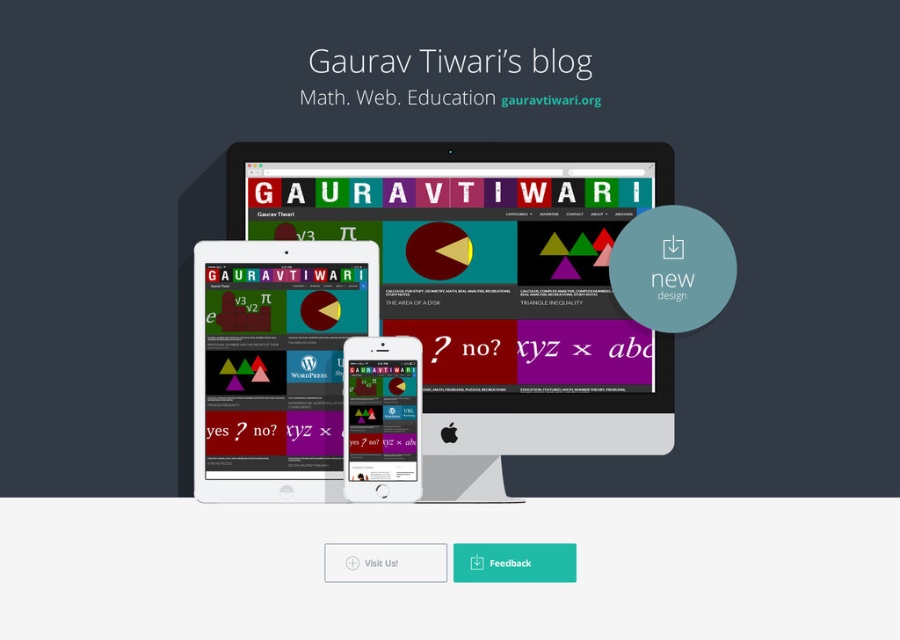
Does matte white tablet at center lie behind white glossy text at center?

No, matte white tablet at center is closer to the viewer.

Can you confirm if matte white tablet at center is taller than white glossy text at center?

Indeed, matte white tablet at center has a greater height compared to white glossy text at center.

Locate an element on the screen. The height and width of the screenshot is (640, 900). matte white tablet at center is located at coordinates (381, 419).

Does white glossy tablet at center have a lesser width compared to matte white tablet at center?

No.

From the picture: Does white glossy tablet at center come in front of matte white tablet at center?

No, white glossy tablet at center is further to the viewer.

Is point (304, 292) positioned behind point (396, 381)?

Yes, it is.

Where is `white glossy tablet at center`? white glossy tablet at center is located at coordinates click(275, 364).

Does point (533, 346) come in front of point (417, 460)?

No, it is behind (417, 460).

Between satin silver monitor at center and matte white tablet at center, which one is positioned lower?

matte white tablet at center is lower down.

Is point (502, 273) positioned in front of point (401, 465)?

No.

Identify the location of satin silver monitor at center. (473, 282).